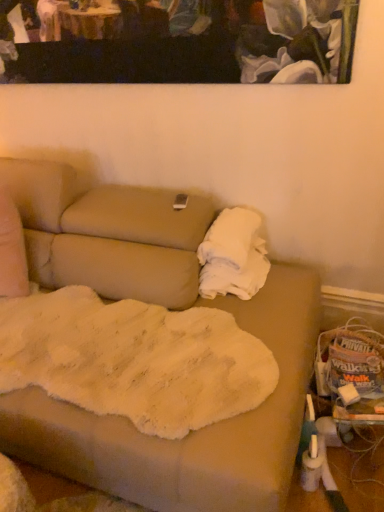
Question: Is white fluffy blanket at right wider or thinner than painted canvas at upper center?

Choices:
 (A) wide
 (B) thin

Answer: (A)

Question: In the image, is white fluffy blanket at right positioned in front of or behind painted canvas at upper center?

Choices:
 (A) behind
 (B) front

Answer: (A)

Question: Based on their sizes in the image, would you say white fluffy blanket at right is bigger or smaller than painted canvas at upper center?

Choices:
 (A) big
 (B) small

Answer: (A)

Question: Is painted canvas at upper center wider or thinner than white fluffy blanket at right?

Choices:
 (A) thin
 (B) wide

Answer: (A)

Question: Is painted canvas at upper center to the left or to the right of white fluffy blanket at right in the image?

Choices:
 (A) left
 (B) right

Answer: (A)

Question: Is painted canvas at upper center inside the boundaries of white fluffy blanket at right, or outside?

Choices:
 (A) inside
 (B) outside

Answer: (B)

Question: In terms of size, does painted canvas at upper center appear bigger or smaller than white fluffy blanket at right?

Choices:
 (A) big
 (B) small

Answer: (B)